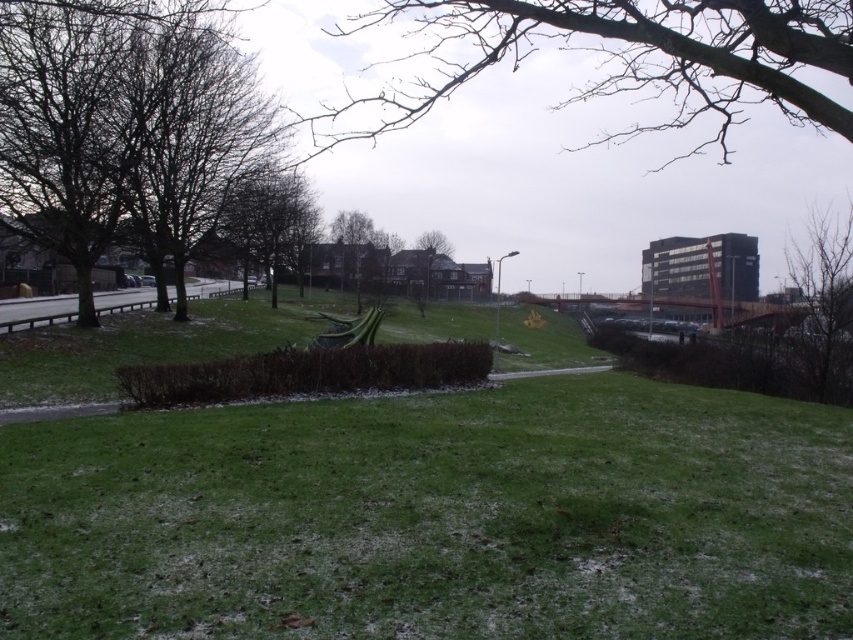
Question: Where is bare branches at upper right located in relation to brown leafless tree at center in the image?

Choices:
 (A) below
 (B) above

Answer: (B)

Question: Which point is farther to the camera?

Choices:
 (A) bare branches at upper right
 (B) green grass at center
 (C) brown leafless tree at center
 (D) bare branches at upper center

Answer: (C)

Question: Is bare branches at left wider than bare branches at upper right?

Choices:
 (A) yes
 (B) no

Answer: (B)

Question: Which is nearer to the bare branches at upper right?

Choices:
 (A) green grass at center
 (B) brown leafless tree at center
 (C) bare branches at upper center

Answer: (A)

Question: Can you confirm if bare branches at upper center is bigger than bare branches at upper right?

Choices:
 (A) no
 (B) yes

Answer: (B)

Question: Which point is closer to the camera?

Choices:
 (A) bare branches at upper right
 (B) brown leafless tree at center

Answer: (A)